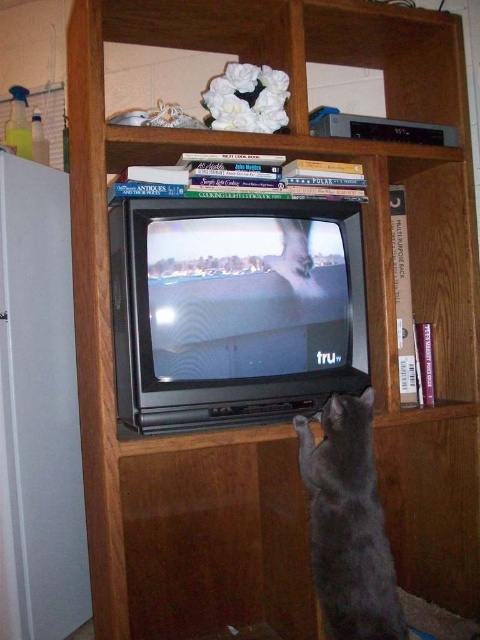
In the scene shown: Who is taller, matte white refrigerator at left or gray fur cat at lower center?

matte white refrigerator at left is taller.

Can you confirm if matte white refrigerator at left is positioned to the right of gray fur cat at lower center?

In fact, matte white refrigerator at left is to the left of gray fur cat at lower center.

You are a GUI agent. You are given a task and a screenshot of the screen. Output one action in this format:
    pyautogui.click(x=<x>, y=<y>)
    Task: Click on the matte white refrigerator at left
    The height and width of the screenshot is (640, 480).
    Given the screenshot: What is the action you would take?
    pyautogui.click(x=38, y=410)

You are a GUI agent. You are given a task and a screenshot of the screen. Output one action in this format:
    pyautogui.click(x=<x>, y=<y>)
    Task: Click on the matte white refrigerator at left
    
    Given the screenshot: What is the action you would take?
    pyautogui.click(x=38, y=410)